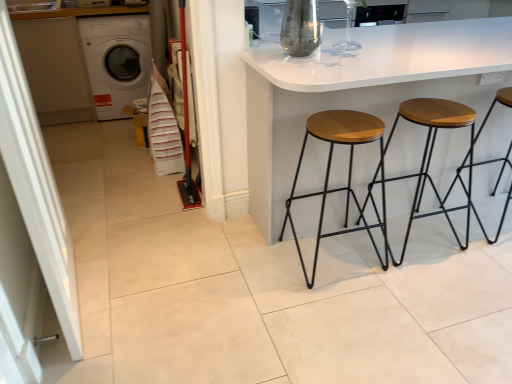
Find the location of a particular element. The image size is (512, 384). free space that is in between wooden/metallic stool at center, marked as the second stool in a right-to-left arrangement, and wooden seat at right, the 3th stool in the left-to-right sequence is located at coordinates (457, 229).